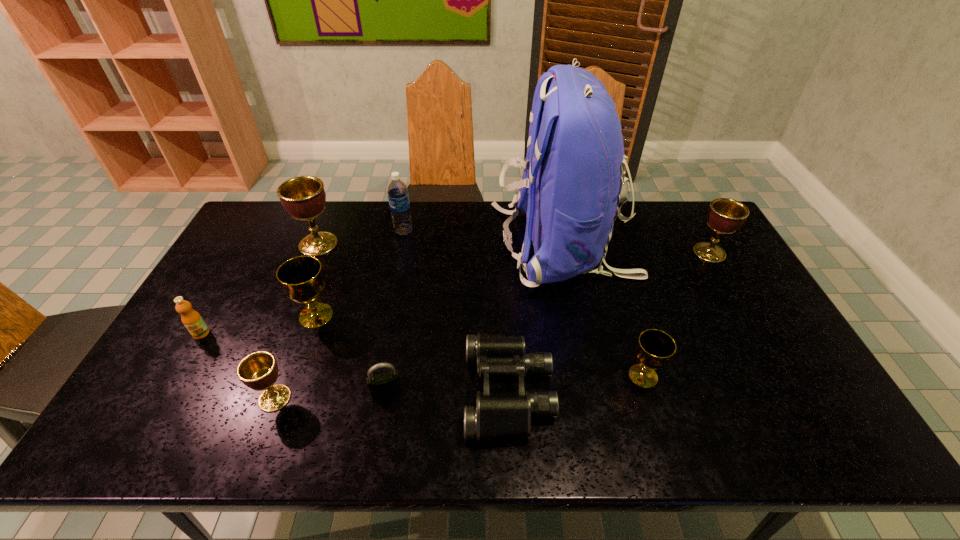
Select which object is the ninth closest to the black binoculars. Please provide its 2D coordinates. Your answer should be formatted as a tuple, i.e. [(x, y)], where the tuple contains the x and y coordinates of a point satisfying the conditions above.

[(192, 320)]

Point out which chalice is positioned as the third nearest to the right gold chalice. Please provide its 2D coordinates. Your answer should be formatted as a tuple, i.e. [(x, y)], where the tuple contains the x and y coordinates of a point satisfying the conditions above.

[(259, 371)]

At what (x,y) coordinates should I click in order to perform the action: click on the fourth closest chalice to the orange juice. Please return your answer as a coordinate pair (x, y). The width and height of the screenshot is (960, 540). Looking at the image, I should click on (655, 348).

Locate an element on the screen. Image resolution: width=960 pixels, height=540 pixels. golden chalice that stands as the closest to the tallest object is located at coordinates (725, 216).

The image size is (960, 540). In order to click on golden chalice that is the second closest to the black binoculars in this screenshot , I will do `click(303, 197)`.

Where is `free space that satisfies the following two spatial constraints: 1. on the front label of the orange juice; 2. on the right side of the smallest golden chalice`? This screenshot has height=540, width=960. free space that satisfies the following two spatial constraints: 1. on the front label of the orange juice; 2. on the right side of the smallest golden chalice is located at coordinates (164, 398).

You are a GUI agent. You are given a task and a screenshot of the screen. Output one action in this format:
    pyautogui.click(x=<x>, y=<y>)
    Task: Click on the vacant point that satisfies the following two spatial constraints: 1. on the front side of the bigger gold chalice; 2. on the right side of the fourth chalice from left to right
    The height and width of the screenshot is (540, 960).
    Given the screenshot: What is the action you would take?
    pyautogui.click(x=295, y=376)